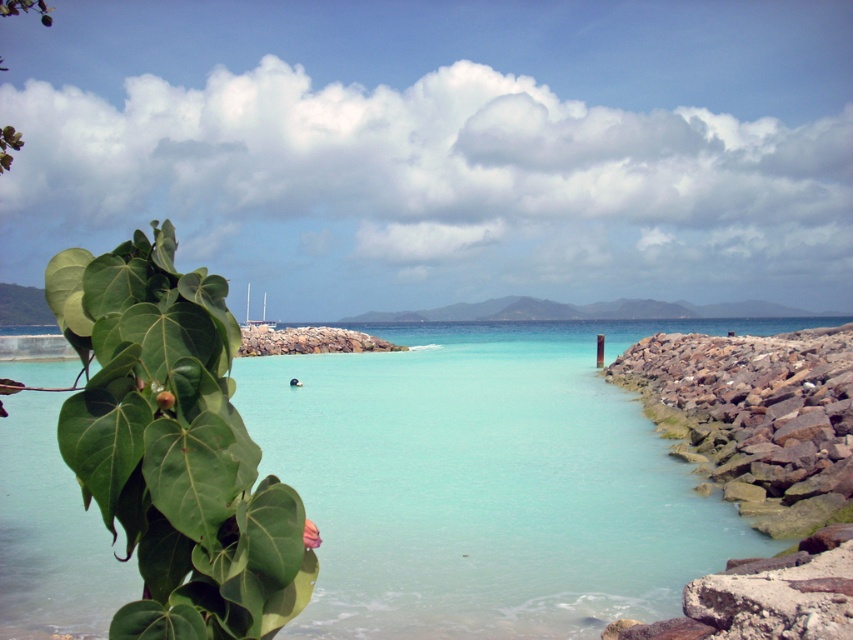
You are a swimmer planning to enter the water. You see the clear blue water at center and the rockyrough stonerocky barrier at right. Which area would be safer for swimming?

The clear blue water at center is safer for swimming because it is positioned under the rockyrough stonerocky barrier at right, which likely blocks rough waves or currents, creating calmer waters there.

You are a kayaker planning to navigate through the coastal area shown. You need to pass between the clear blue water at center and the rockyrough stonerocky barrier at right. Based on the scene description, which path would allow your kayak to pass safely?

The clear blue water at center is wider than the rockyrough stonerocky barrier at right, so the path through the clear blue water at center would be wide enough for the kayak to pass safely.